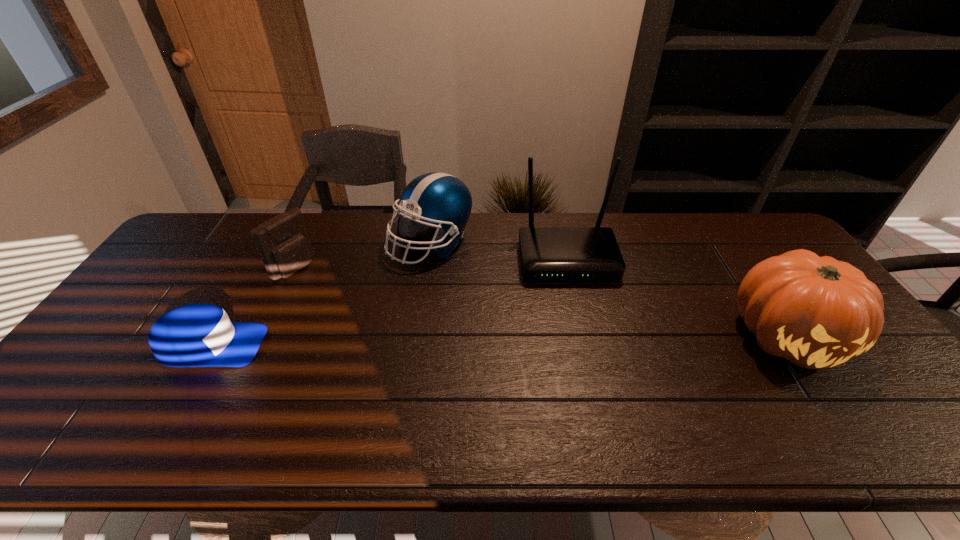
At what (x,y) coordinates should I click in order to perform the action: click on free spot between the pouch and the football helmet. Please return your answer as a coordinate pair (x, y). Image resolution: width=960 pixels, height=540 pixels. Looking at the image, I should click on (362, 255).

You are a GUI agent. You are given a task and a screenshot of the screen. Output one action in this format:
    pyautogui.click(x=<x>, y=<y>)
    Task: Click on the free spot between the rightmost object and the third object from left to right
    The image size is (960, 540).
    Given the screenshot: What is the action you would take?
    pyautogui.click(x=609, y=290)

Identify the location of free spot between the rightmost object and the baseball cap. The image size is (960, 540). (499, 341).

The width and height of the screenshot is (960, 540). Identify the location of free space between the router and the baseball cap. (390, 302).

Where is `vacant space that's between the pumpkin and the router`? vacant space that's between the pumpkin and the router is located at coordinates (677, 298).

I want to click on free area in between the router and the football helmet, so click(499, 251).

Locate an element on the screen. This screenshot has width=960, height=540. vacant region between the router and the pumpkin is located at coordinates (677, 298).

I want to click on free space between the baseball cap and the third object from left to right, so click(x=321, y=294).

Find the location of `the second closest object to the fourth object from left to right`. the second closest object to the fourth object from left to right is located at coordinates (817, 312).

Identify which object is located as the fourth nearest to the rightmost object. Please provide its 2D coordinates. Your answer should be formatted as a tuple, i.e. [(x, y)], where the tuple contains the x and y coordinates of a point satisfying the conditions above.

[(197, 335)]